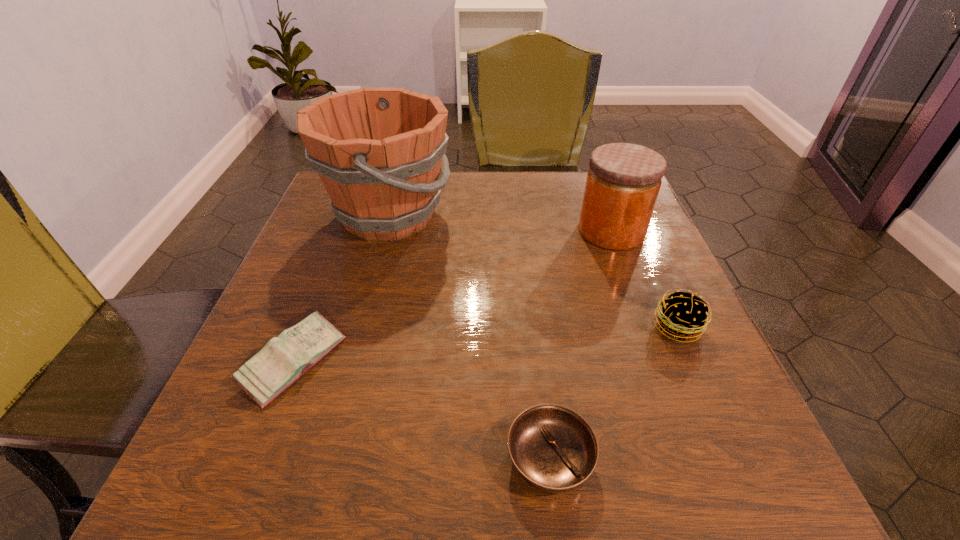
Locate an element on the screen. the tallest object is located at coordinates (378, 151).

This screenshot has width=960, height=540. I want to click on the fourth shortest object, so click(x=623, y=182).

Identify the location of the third shortest object. The height and width of the screenshot is (540, 960). (683, 315).

At what (x,y) coordinates should I click in order to perform the action: click on the fourth tallest object. Please return your answer as a coordinate pair (x, y). This screenshot has height=540, width=960. Looking at the image, I should click on (284, 359).

You are a GUI agent. You are given a task and a screenshot of the screen. Output one action in this format:
    pyautogui.click(x=<x>, y=<y>)
    Task: Click on the nearest object
    The image size is (960, 540).
    Given the screenshot: What is the action you would take?
    pyautogui.click(x=554, y=449)

Where is `the shortest object`? The width and height of the screenshot is (960, 540). the shortest object is located at coordinates (554, 449).

Where is `free point located on the handle side of the tallest object`? free point located on the handle side of the tallest object is located at coordinates (592, 215).

At what (x,y) coordinates should I click in order to perform the action: click on vacant area situated 0.390m on the front of the second tallest object. Please return your answer as a coordinate pair (x, y). This screenshot has width=960, height=540. Looking at the image, I should click on (680, 416).

Image resolution: width=960 pixels, height=540 pixels. In order to click on free space located on the back of the third tallest object in this screenshot , I will do `click(644, 252)`.

Find the location of a particular element. free space located on the back of the diary is located at coordinates (318, 299).